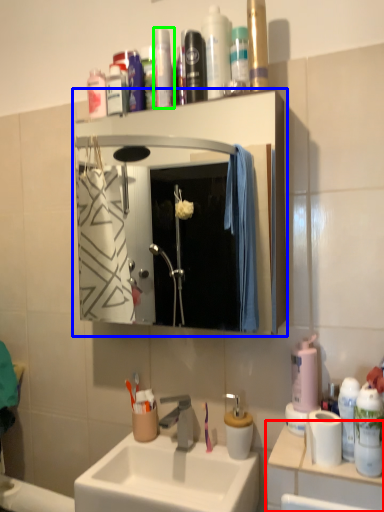
Question: Which object is the closest to the counter top (highlighted by a red box)? Choose among these: bathroom cabinet (highlighted by a blue box) or toiletry (highlighted by a green box).

Choices:
 (A) bathroom cabinet
 (B) toiletry

Answer: (B)